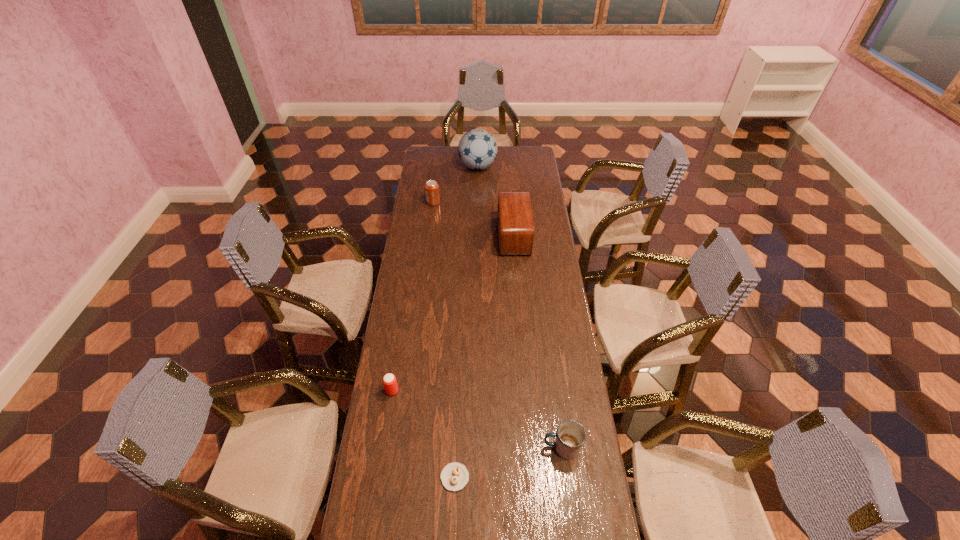
Locate an element on the screen. This screenshot has height=540, width=960. free area in between the soccer ball and the can is located at coordinates (456, 185).

This screenshot has height=540, width=960. Identify the location of free space between the fifth object from right to left and the third shortest object. (497, 325).

Select which object is the third closest to the fifth nearest object. Please provide its 2D coordinates. Your answer should be formatted as a tuple, i.e. [(x, y)], where the tuple contains the x and y coordinates of a point satisfying the conditions above.

[(389, 380)]

Identify which object is located as the fourth nearest to the beer can. Please provide its 2D coordinates. Your answer should be formatted as a tuple, i.e. [(x, y)], where the tuple contains the x and y coordinates of a point satisfying the conditions above.

[(432, 193)]

Where is `free space that satisfies the following two spatial constraints: 1. on the front panel of the second tallest object; 2. on the front side of the cupcake`? The height and width of the screenshot is (540, 960). free space that satisfies the following two spatial constraints: 1. on the front panel of the second tallest object; 2. on the front side of the cupcake is located at coordinates 533,477.